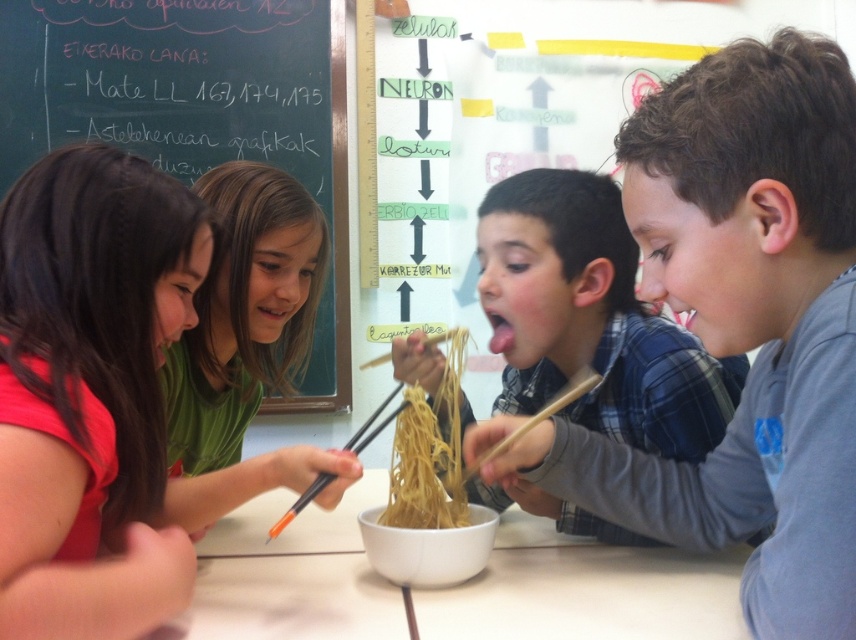
Question: Which of these objects is positioned farthest from the wooden chopsticks at center?

Choices:
 (A) smooth brown hair at center
 (B) yellow matte chopstick at center
 (C) black chalkboard at upper left

Answer: (C)

Question: Which object is the farthest from the matte red shirt at left?

Choices:
 (A) smooth gray shirt at right
 (B) wooden chopsticks at center

Answer: (A)

Question: Can you confirm if matte red shirt at left is positioned below white matte table at center?

Choices:
 (A) yes
 (B) no

Answer: (B)

Question: Can you confirm if white matte table at center is positioned above yellow matte chopstick at center?

Choices:
 (A) no
 (B) yes

Answer: (A)

Question: Can you confirm if white matte table at center is bigger than yellow matte chopstick at center?

Choices:
 (A) no
 (B) yes

Answer: (A)

Question: Which of the following is the farthest from the observer?

Choices:
 (A) (301, 38)
 (B) (197, 625)

Answer: (A)